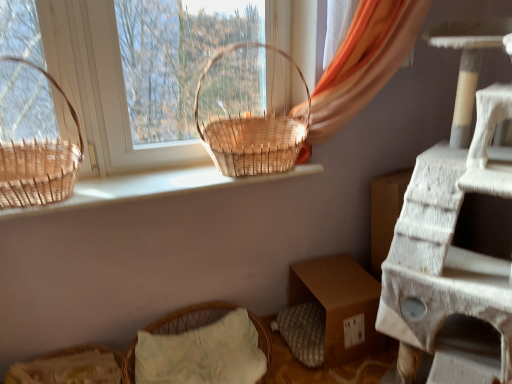
Image resolution: width=512 pixels, height=384 pixels. Identify the location of empty space that is in between woven natural basket at center, which appears as the 1th picnic basket when viewed from the right, and brown woven basket at left, the second picnic basket viewed from the right. (147, 181).